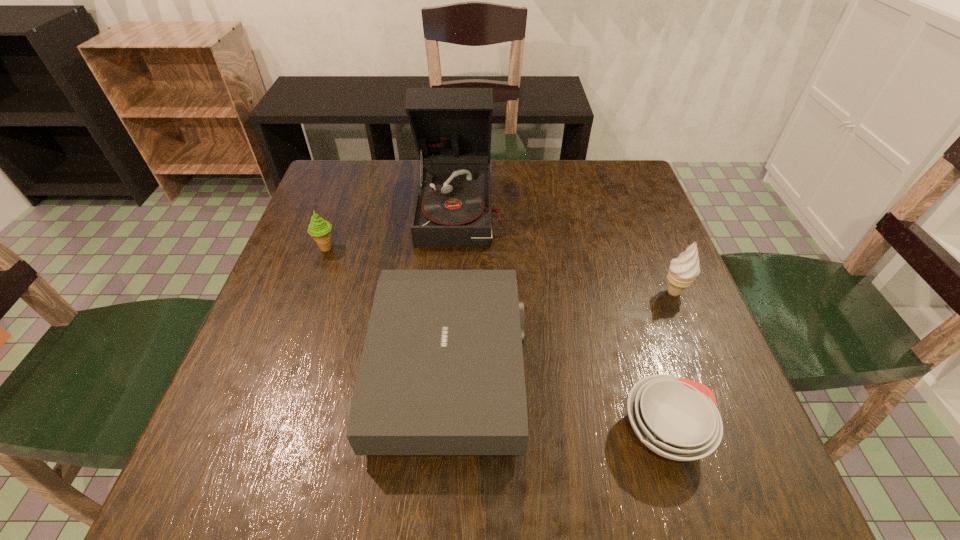
Identify the location of vacant space located on the front-facing side of the taller icecream. (477, 292).

Where is `vacant region located 0.240m on the front-facing side of the taller icecream`? vacant region located 0.240m on the front-facing side of the taller icecream is located at coordinates (550, 292).

This screenshot has width=960, height=540. I want to click on blank area located 0.260m on the right of the left icecream, so click(x=444, y=248).

The image size is (960, 540). What are the coordinates of `vacant space located 0.150m on the front-facing side of the projector` in the screenshot? It's located at (603, 370).

You are a GUI agent. You are given a task and a screenshot of the screen. Output one action in this format:
    pyautogui.click(x=<x>, y=<y>)
    Task: Click on the free space located on the left of the shortest object
    The image size is (960, 540).
    Given the screenshot: What is the action you would take?
    click(495, 432)

Find the location of a particular element. object that is positioned at the far edge is located at coordinates (451, 127).

Image resolution: width=960 pixels, height=540 pixels. I want to click on projector present at the near edge, so click(441, 372).

Locate an element on the screen. This screenshot has height=540, width=960. soup bowl located at the near edge is located at coordinates (677, 418).

This screenshot has width=960, height=540. What are the coordinates of `object located in the left edge section of the desktop` in the screenshot? It's located at tap(319, 229).

Locate an element on the screen. The width and height of the screenshot is (960, 540). icecream situated at the right edge is located at coordinates (683, 270).